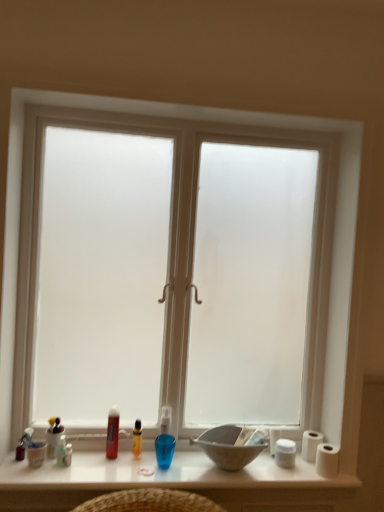
Where is `free location in front of translucent plastic tube at lower center, which is counted as the second toiletry, starting from the right`? The image size is (384, 512). free location in front of translucent plastic tube at lower center, which is counted as the second toiletry, starting from the right is located at coordinates (101, 470).